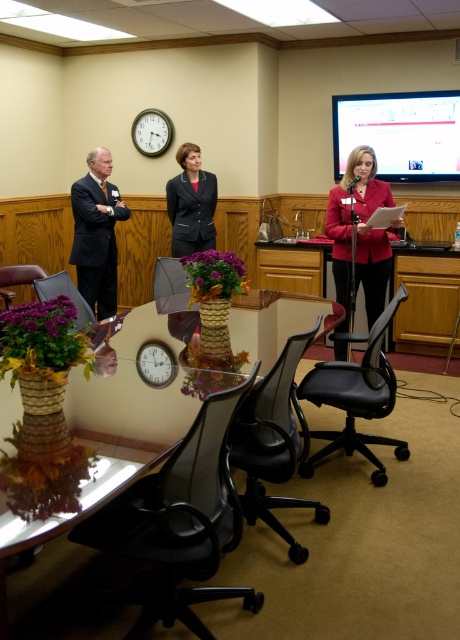
Can you confirm if black mesh swivel chair at center is positioned to the left of black mesh office chair at center?

In fact, black mesh swivel chair at center is to the right of black mesh office chair at center.

Can you confirm if black mesh swivel chair at center is thinner than black mesh office chair at center?

Incorrect, black mesh swivel chair at center's width is not less than black mesh office chair at center's.

The image size is (460, 640). What do you see at coordinates (274, 442) in the screenshot? I see `black mesh swivel chair at center` at bounding box center [274, 442].

Locate an element on the screen. Image resolution: width=460 pixels, height=640 pixels. black mesh swivel chair at center is located at coordinates (274, 442).

Can you confirm if black plastic swivel chair at lower center is bigger than black mesh office chair at center?

Indeed, black plastic swivel chair at lower center has a larger size compared to black mesh office chair at center.

Between black plastic swivel chair at lower center and black mesh office chair at center, which one is positioned higher?

Positioned higher is black mesh office chair at center.

Is point (197, 435) closer to camera compared to point (164, 268)?

Yes, point (197, 435) is in front of point (164, 268).

What are the coordinates of `black plastic swivel chair at lower center` in the screenshot? It's located at (178, 524).

Is matte plastic screen at upper right shorter than dark blue suit at left?

Correct, matte plastic screen at upper right is not as tall as dark blue suit at left.

Does matte plastic screen at upper right lie behind dark blue suit at left?

Yes, matte plastic screen at upper right is further from the viewer.

The width and height of the screenshot is (460, 640). Find the location of `matte plastic screen at upper right`. matte plastic screen at upper right is located at coordinates (400, 132).